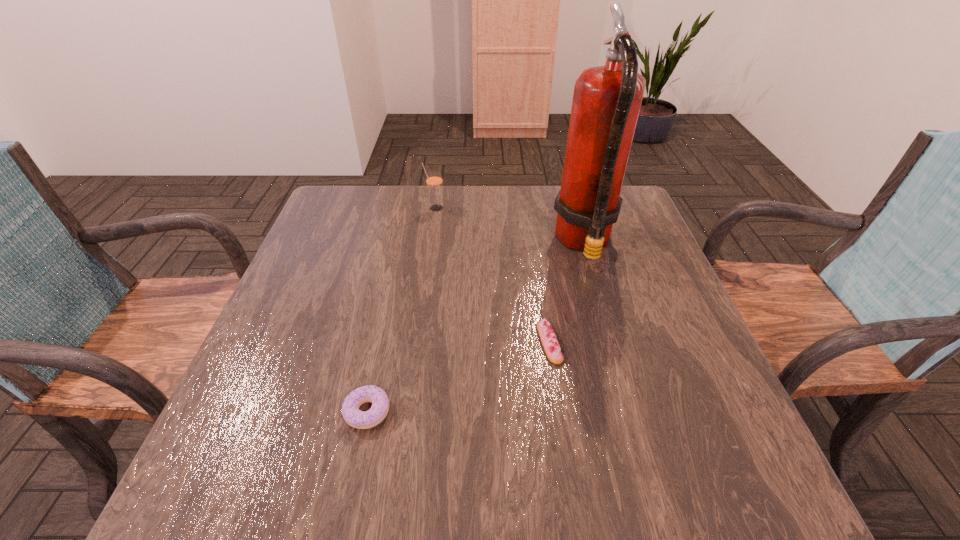
This screenshot has height=540, width=960. I want to click on vacant space that is in between the nearest object and the farthest object, so click(x=401, y=310).

At what (x,y) coordinates should I click in order to perform the action: click on vacant space that's between the leftmost object and the eclair. Please return your answer as a coordinate pair (x, y). This screenshot has width=960, height=540. Looking at the image, I should click on (458, 377).

At what (x,y) coordinates should I click in order to perform the action: click on vacant region between the second tallest object and the second nearest object. Please return your answer as a coordinate pair (x, y). Looking at the image, I should click on (492, 275).

Locate which object ranks in proximity to the fire extinguisher. Please provide its 2D coordinates. Your answer should be formatted as a tuple, i.e. [(x, y)], where the tuple contains the x and y coordinates of a point satisfying the conditions above.

[(548, 338)]

Identify which object is the closest to the farthest object. Please provide its 2D coordinates. Your answer should be formatted as a tuple, i.e. [(x, y)], where the tuple contains the x and y coordinates of a point satisfying the conditions above.

[(606, 103)]

Identify the location of free space in the image that satisfies the following two spatial constraints: 1. on the back side of the nearest object; 2. on the left side of the second tallest object. (x=410, y=208).

This screenshot has width=960, height=540. Identify the location of vacant area in the image that satisfies the following two spatial constraints: 1. on the back side of the second object from right to left; 2. on the left side of the nearest object. (382, 343).